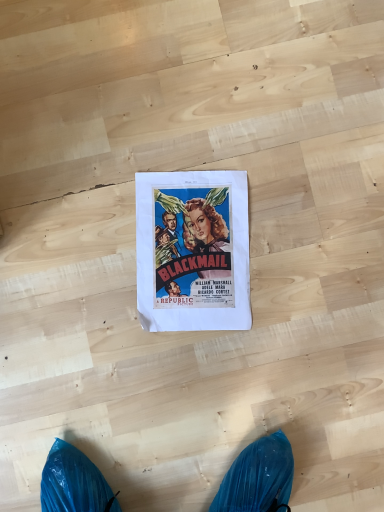
The image size is (384, 512). Find the location of `vacant region above matte paper poster at center (from a real-world perspective)`. vacant region above matte paper poster at center (from a real-world perspective) is located at coordinates (195, 248).